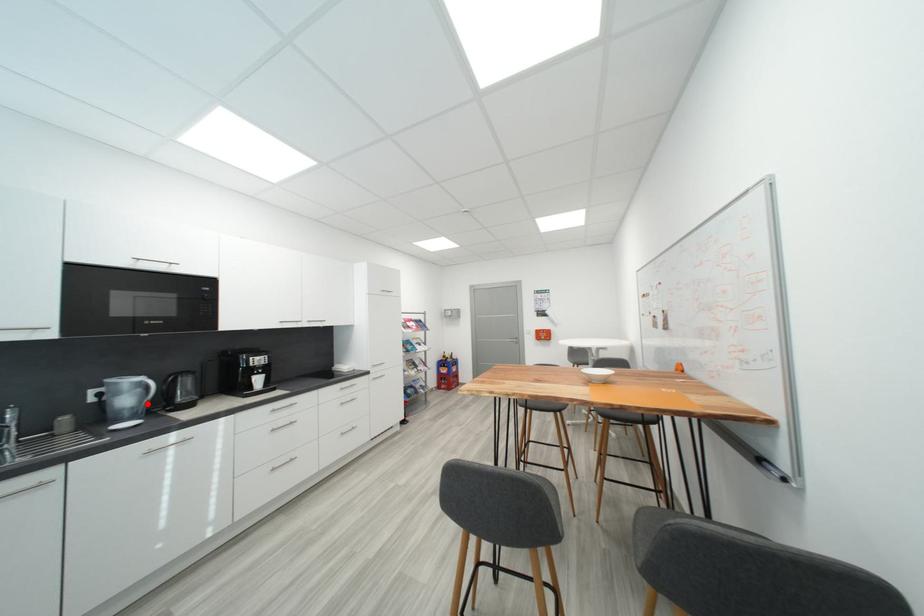
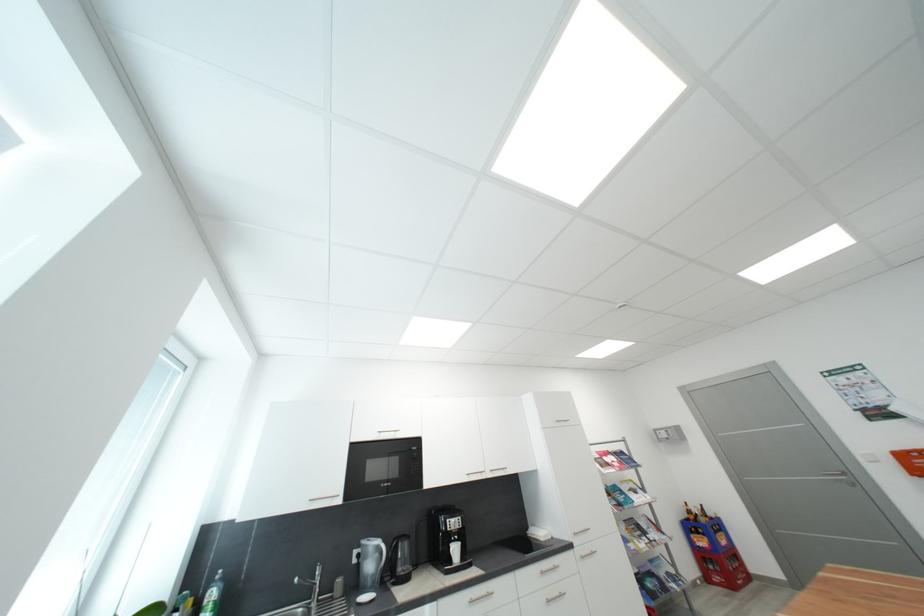
Question: A red point is marked in image1. In image2, is the corresponding 3D point closer to the camera or farther? Reply with the corresponding letter.

Choices:
 (A) The corresponding 3D point is closer.
 (B) The corresponding 3D point is farther.

Answer: (B)